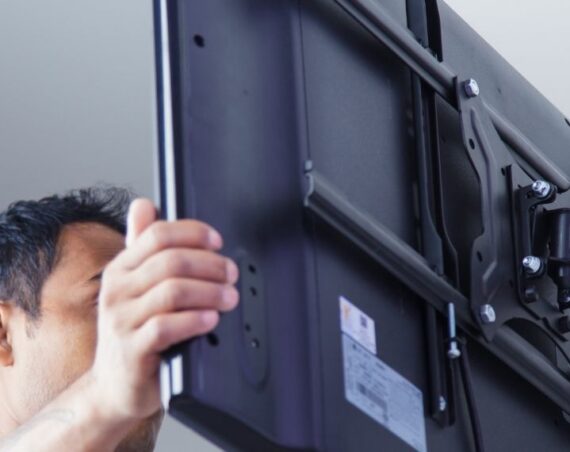
At what (x,y) coordinates should I click in order to perform the action: click on back of monitor/tv. Please return your answer as a coordinate pair (x, y). Looking at the image, I should click on (348, 163).